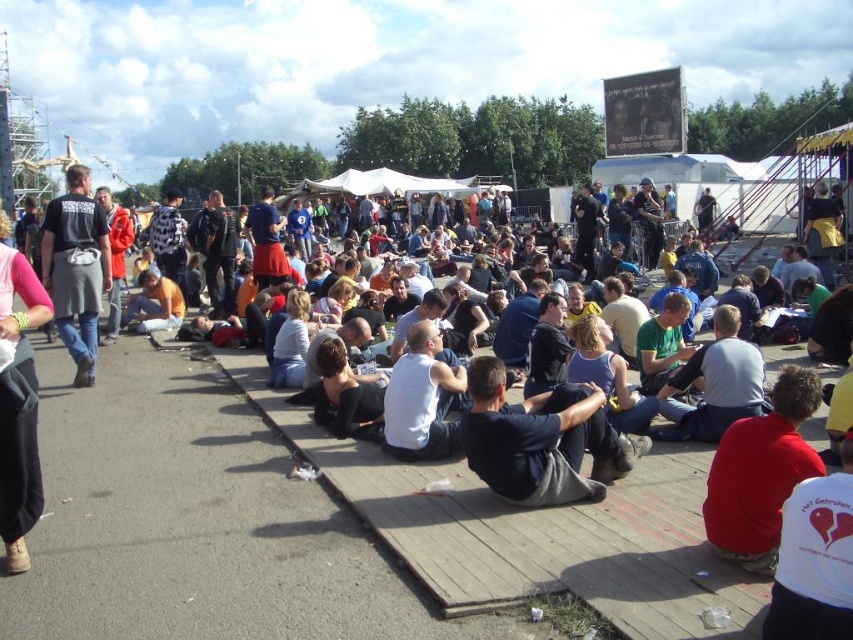
Which is in front, point (486, 433) or point (84, 234)?

Positioned in front is point (486, 433).

Which is below, dark blue fabric at center or black fabric shirt at left?

dark blue fabric at center

Which is in front, point (606, 428) or point (64, 232)?

Point (606, 428) is more forward.

Locate an element on the screen. dark blue fabric at center is located at coordinates (541, 440).

Who is more distant from viewer, (763,464) or (71,198)?

The point (71,198) is more distant.

Which is in front, point (802, 381) or point (57, 257)?

Positioned in front is point (802, 381).

This screenshot has height=640, width=853. Find the location of `red cotton shirt at lower right`. red cotton shirt at lower right is located at coordinates (759, 472).

Does dark blue fabric at center appear under white cotton tank top at center?

Yes.

Where is `dark blue fabric at center`? dark blue fabric at center is located at coordinates (541, 440).